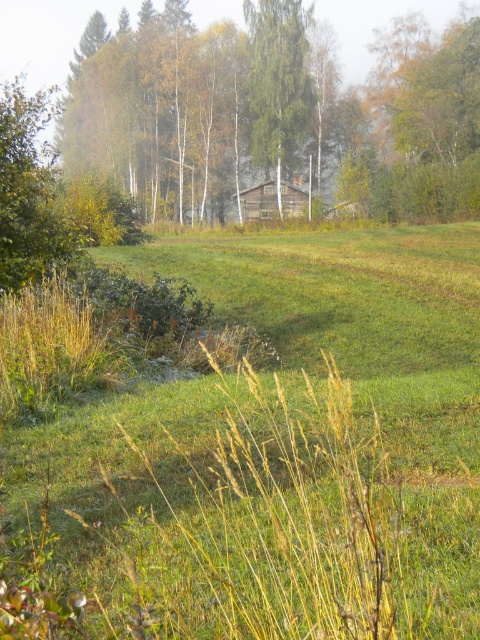
Does green grassy pasture at center appear on the left side of white bark birch tree at center?

Indeed, green grassy pasture at center is positioned on the left side of white bark birch tree at center.

Which of these two, green grassy pasture at center or white bark birch tree at center, stands shorter?

green grassy pasture at center is shorter.

Which is in front, point (283, 323) or point (287, 20)?

Positioned in front is point (283, 323).

The width and height of the screenshot is (480, 640). I want to click on green grassy pasture at center, so click(375, 365).

Is green grassy pasture at center to the right of wooden cabin at center from the viewer's perspective?

No, green grassy pasture at center is not to the right of wooden cabin at center.

Is point (121, 433) behind point (286, 205)?

No, (121, 433) is closer to viewer.

Identify the location of green grassy pasture at center. This screenshot has width=480, height=640. click(x=375, y=365).

Does point (203, 182) lie in front of point (271, 99)?

No, it is not.

Which is behind, point (195, 132) or point (311, 90)?

The point (195, 132) is more distant.

Does point (243, 90) come behind point (262, 154)?

That is True.

This screenshot has width=480, height=640. I want to click on green wood house at center, so [271, 108].